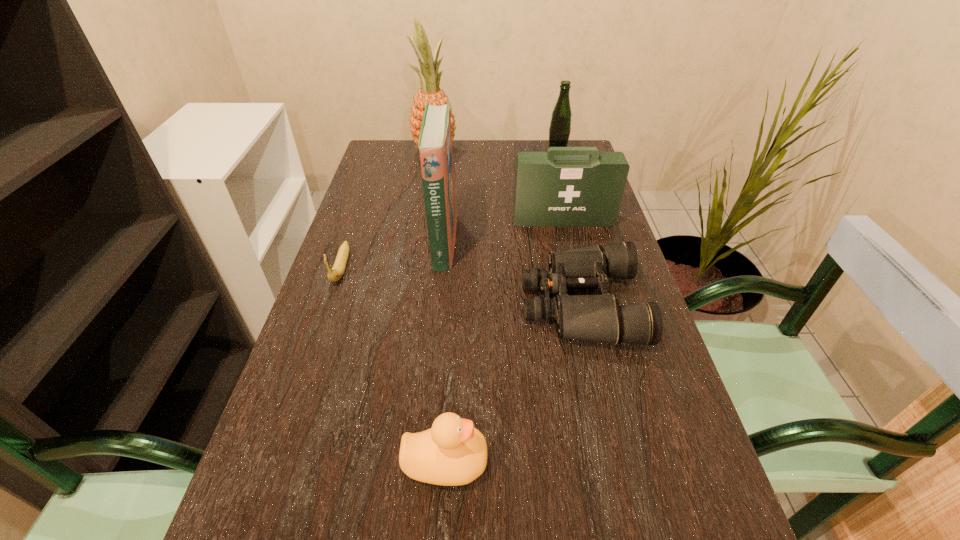
I want to click on vacant area that lies between the first-aid kit and the hardback book, so pyautogui.click(x=503, y=231).

The width and height of the screenshot is (960, 540). I want to click on free space between the third tallest object and the second tallest object, so click(x=500, y=201).

Locate an element on the screen. The height and width of the screenshot is (540, 960). empty location between the binoculars and the duck is located at coordinates (514, 383).

Locate an element on the screen. vacant area that lies between the first-aid kit and the nearest object is located at coordinates (504, 340).

This screenshot has height=540, width=960. Find the location of `vacant point located between the binoculars and the hardback book`. vacant point located between the binoculars and the hardback book is located at coordinates (513, 273).

Where is `object that can be found as the closest to the fifth shortest object`? This screenshot has height=540, width=960. object that can be found as the closest to the fifth shortest object is located at coordinates (566, 186).

Where is `object that is the second closest to the banana`? object that is the second closest to the banana is located at coordinates (451, 453).

Image resolution: width=960 pixels, height=540 pixels. I want to click on vacant space that satisfies the following two spatial constraints: 1. on the front-facing side of the fourth shortest object; 2. on the face of the duck, so [619, 461].

Find the location of `vacant space that satisfies the following two spatial constraints: 1. on the cover of the hardback book; 2. at the stem of the banana`. vacant space that satisfies the following two spatial constraints: 1. on the cover of the hardback book; 2. at the stem of the banana is located at coordinates (442, 267).

I want to click on vacant area in the image that satisfies the following two spatial constraints: 1. on the cover of the sixth shortest object; 2. at the stem of the leftmost object, so click(x=442, y=267).